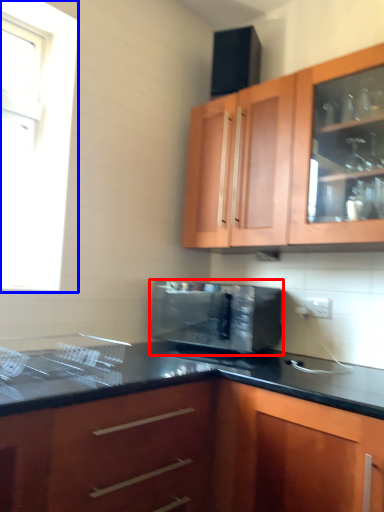
Question: Among these objects, which one is nearest to the camera, microwave oven (highlighted by a red box) or window (highlighted by a blue box)?

Choices:
 (A) microwave oven
 (B) window

Answer: (A)